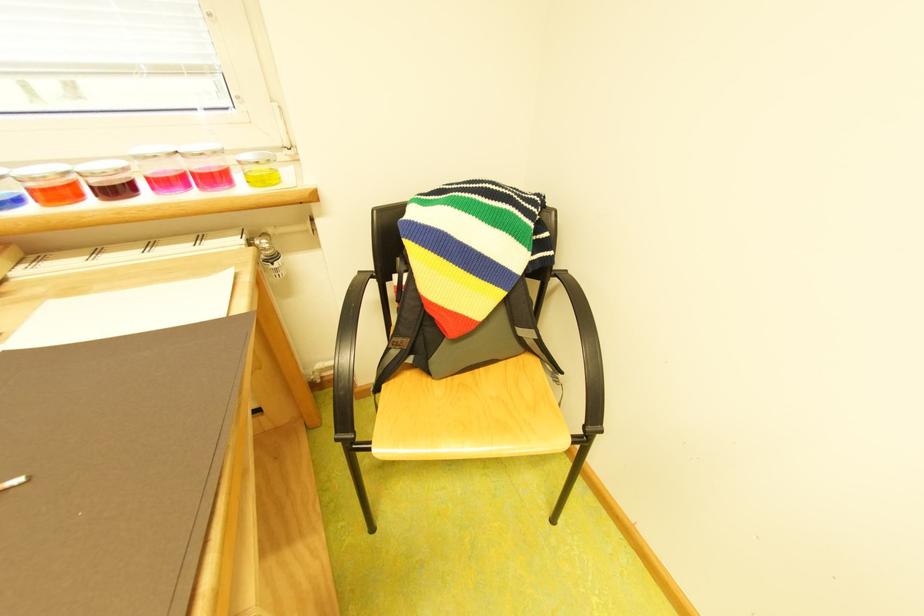
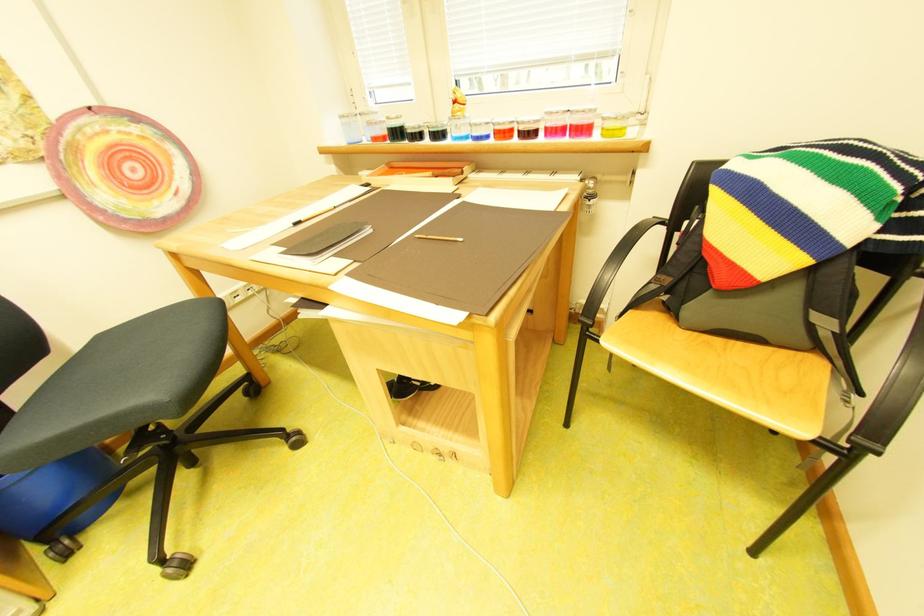
Where in the second image is the point corresponding to pixel 29 201 from the first image?

(499, 138)